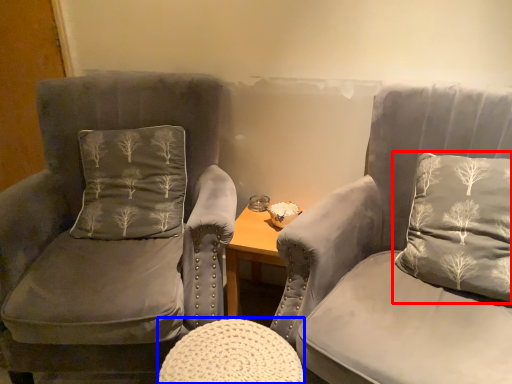
Question: Among these objects, which one is nearest to the camera, pillow (highlighted by a red box) or stool (highlighted by a blue box)?

Choices:
 (A) pillow
 (B) stool

Answer: (B)